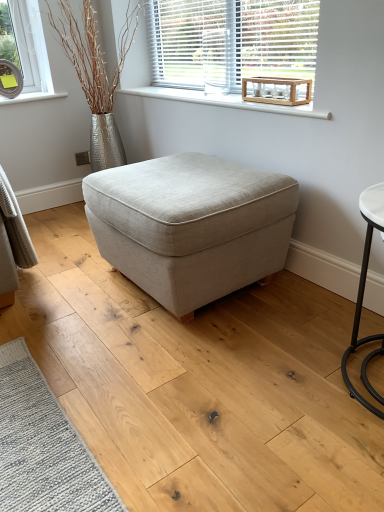
This screenshot has height=512, width=384. What are the coordinates of `free space in front of beige fabric ottoman at center` in the screenshot? It's located at (176, 378).